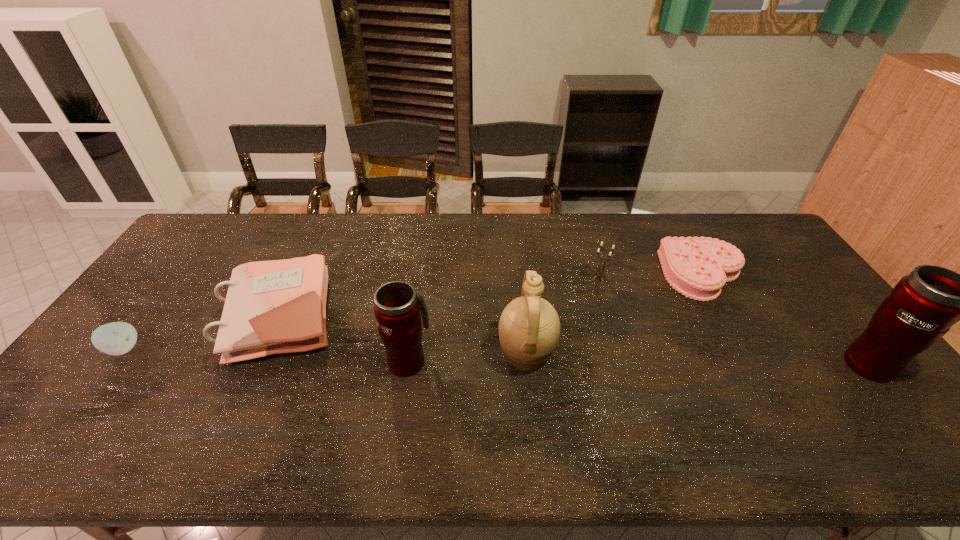
The image size is (960, 540). Find the location of `free spot between the taller thermos bottle and the sixth object from left to right`. free spot between the taller thermos bottle and the sixth object from left to right is located at coordinates (785, 319).

You are a GUI agent. You are given a task and a screenshot of the screen. Output one action in this format:
    pyautogui.click(x=<x>, y=<y>)
    Task: Click on the vacant space that is in between the taller thermos bottle and the leftmost object
    Image resolution: width=960 pixels, height=540 pixels.
    Given the screenshot: What is the action you would take?
    pyautogui.click(x=496, y=356)

Locate an element on the screen. The width and height of the screenshot is (960, 540). empty space that is in between the fourth object from left to right and the cake is located at coordinates (614, 314).

Find the location of a particular element. The image size is (960, 540). free spot between the rightmost object and the second object from left to right is located at coordinates (574, 339).

Identify the location of vacant space in between the rightmost object and the phonebook. (574, 339).

You are a GUI agent. You are given a task and a screenshot of the screen. Output one action in this format:
    pyautogui.click(x=<x>, y=<y>)
    Task: Click on the empty space that is in between the leftmost object and the pitcher
    The image size is (960, 540).
    Given the screenshot: What is the action you would take?
    pyautogui.click(x=324, y=351)

Locate an element on the screen. The width and height of the screenshot is (960, 540). vacant point located between the pitcher and the right thermos bottle is located at coordinates (698, 358).

At what (x,y) coordinates should I click in order to perform the action: click on the closest object to the leftmost object. Please return your answer as a coordinate pair (x, y). Looking at the image, I should click on click(271, 307).

Locate which object is the sixth closest to the apple. Please provide its 2D coordinates. Your answer should be formatted as a tuple, i.e. [(x, y)], where the tuple contains the x and y coordinates of a point satisfying the conditions above.

[(923, 306)]

Identify the location of vacant space that satisfies the following two spatial constraints: 1. on the side with the handle of the shortest object; 2. on the right side of the left thermos bottle. pos(421,275).